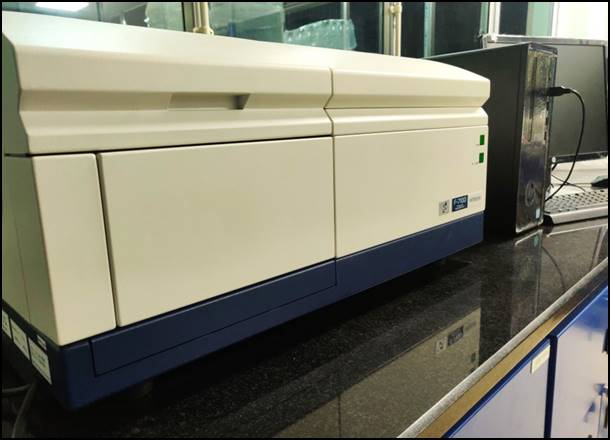
Locate an element on the screen. The image size is (610, 440). computer is located at coordinates (531, 116).